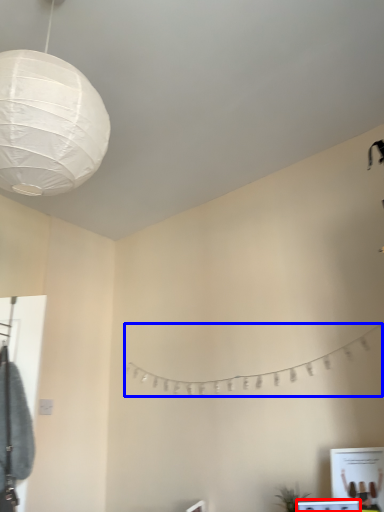
Question: Which of the following is the farthest to the observer, vanity (highlighted by a red box) or clothesline (highlighted by a blue box)?

Choices:
 (A) vanity
 (B) clothesline

Answer: (B)